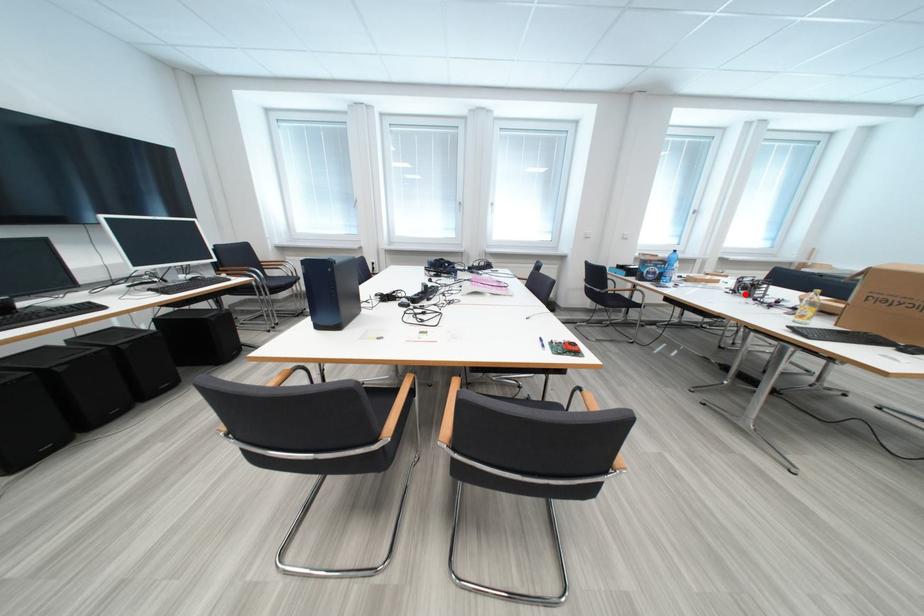
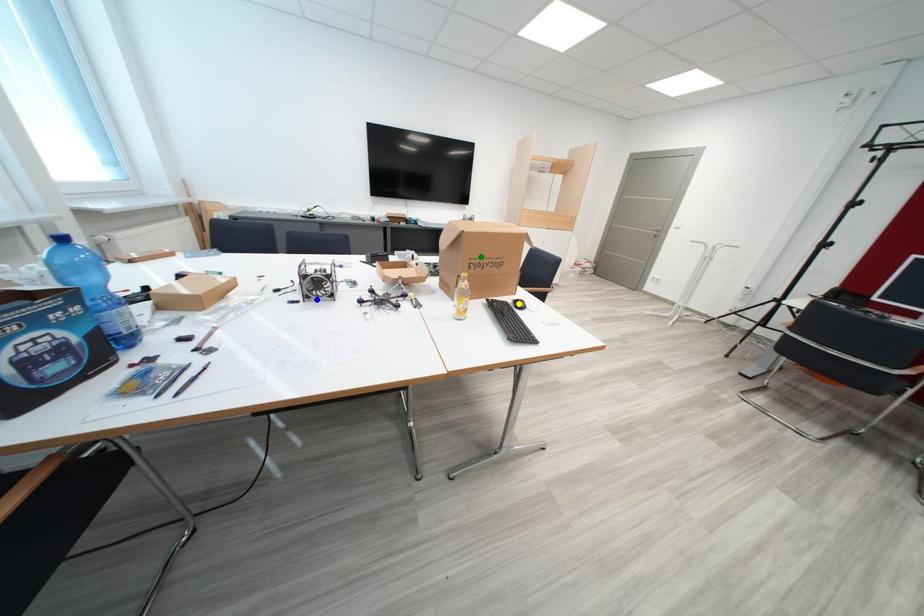
Question: I am providing you with two images of the same scene from different viewpoints. A red point is marked on the first image. You are given multiple points on the second image. In image 2, which mark is for the same physical point as the one in image 1?

Choices:
 (A) yellow point
 (B) blue point
 (C) green point

Answer: (B)